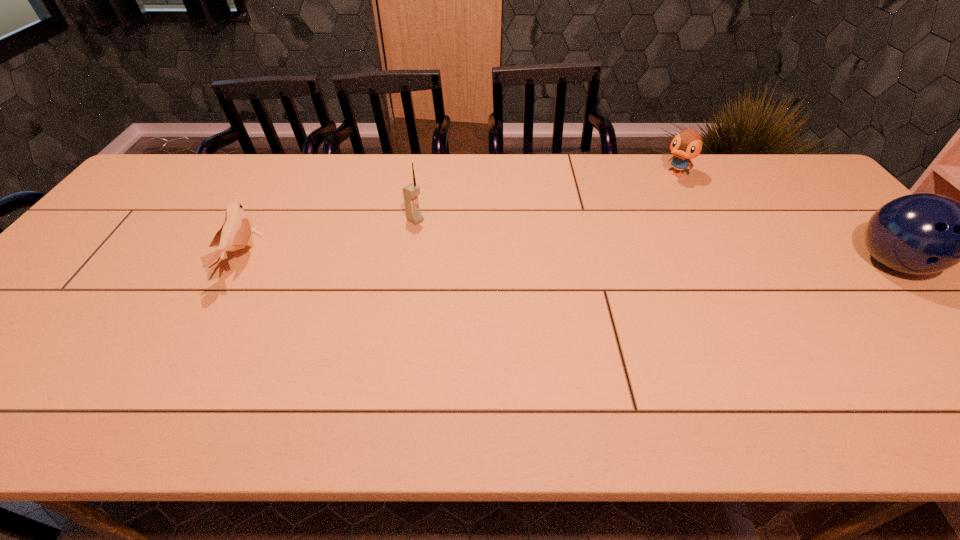
The height and width of the screenshot is (540, 960). Identify the location of free spot on the desktop that is between the bird and the rightmost object and is positioned on the front of the cellular telephone, where the keypad is located. (484, 260).

Find the location of a particular element. The image size is (960, 540). vacant space on the desktop that is between the bird and the rightmost object and is positioned on the front-facing side of the duck is located at coordinates [601, 261].